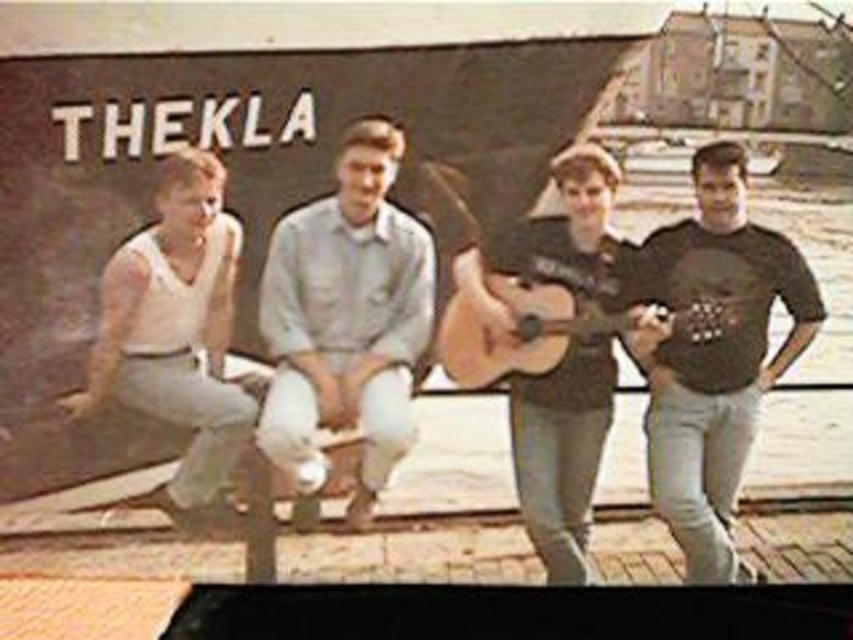
Question: Is dark brown t-shirt at right to the left of brown matte guitar at center from the viewer's perspective?

Choices:
 (A) yes
 (B) no

Answer: (B)

Question: Is the position of light gray cotton shirt at center less distant than that of light brown wooden guitar at center?

Choices:
 (A) yes
 (B) no

Answer: (B)

Question: Estimate the real-world distances between objects in this image. Which object is closer to the brown matte guitar at center?

Choices:
 (A) light brown wooden guitar at center
 (B) dark brown t-shirt at right

Answer: (A)

Question: Is the position of light gray cotton shirt at center more distant than that of brown matte guitar at center?

Choices:
 (A) yes
 (B) no

Answer: (A)

Question: Among these objects, which one is farthest from the camera?

Choices:
 (A) light brown wooden guitar at center
 (B) dark brown t-shirt at right
 (C) light gray cotton shirt at center
 (D) white matte tank top at left

Answer: (C)

Question: Considering the real-world distances, which object is closest to the light gray cotton shirt at center?

Choices:
 (A) white matte tank top at left
 (B) brown matte guitar at center

Answer: (A)